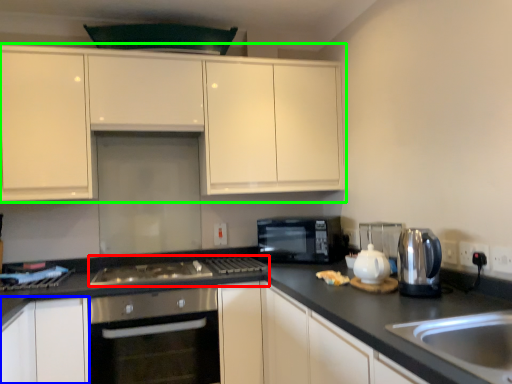
Question: Considering the real-world distances, which object is closest to gas stove (highlighted by a red box)? cabinetry (highlighted by a blue box) or cabinetry (highlighted by a green box).

Choices:
 (A) cabinetry
 (B) cabinetry

Answer: (A)